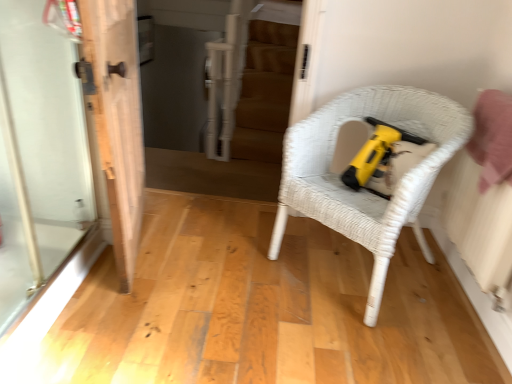
You are a GUI agent. You are given a task and a screenshot of the screen. Output one action in this format:
    pyautogui.click(x=<x>, y=<y>)
    Task: Click on the vacant space that's between white wicker chair at center and white wood door at left
    
    Given the screenshot: What is the action you would take?
    pyautogui.click(x=217, y=259)